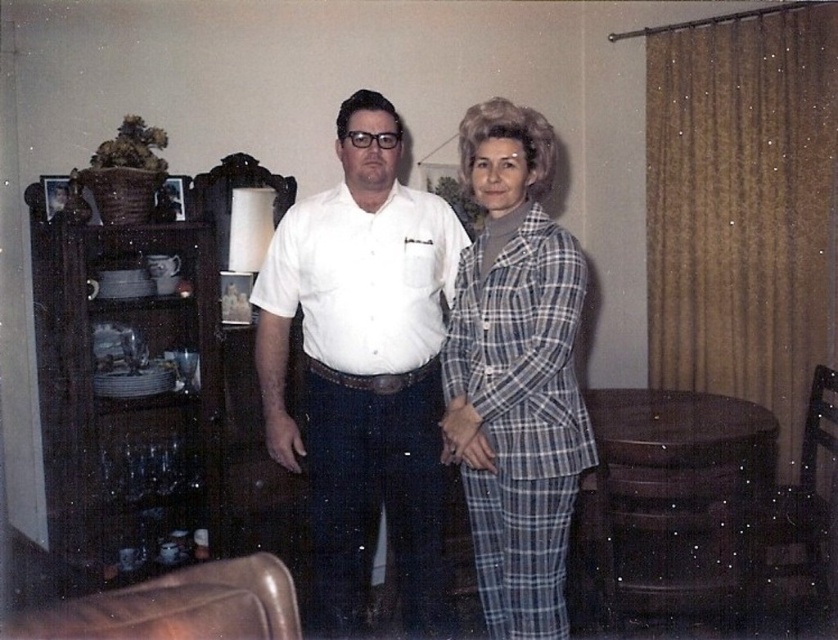
Based on the scene description, if you were to stand in the middle of the room, which object would appear taller when looking at the white cotton shirt at center and the plaid fabric suit at center?

The white cotton shirt at center is much taller than the plaid fabric suit at center according to the description.

You are a photographer trying to focus on the person in the background. Which of the two people, the white cotton shirt at center or the plaid fabric suit at center, should you adjust your camera to focus on?

The plaid fabric suit at center is further away from the viewer than the white cotton shirt at center, so you should adjust your camera to focus on the plaid fabric suit at center.